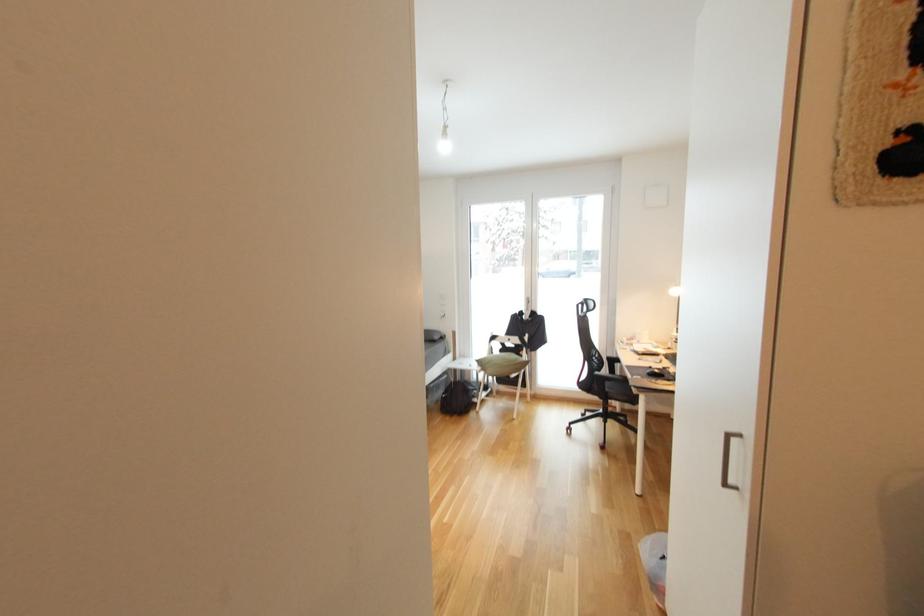
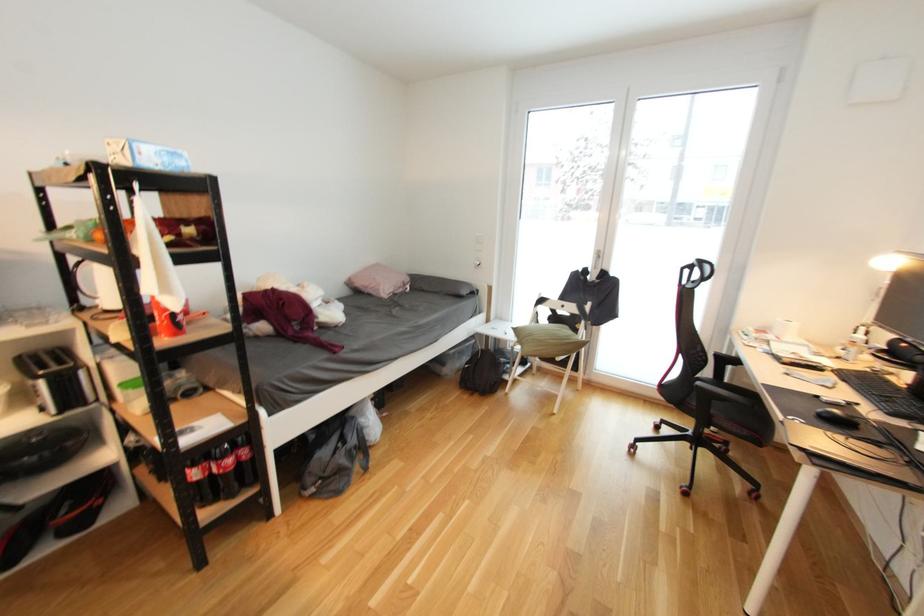
Question: The camera is either moving clockwise (left) or counter-clockwise (right) around the object. The first image is from the beginning of the video and the second image is from the end. Is the camera moving left or right when shooting the video?

Choices:
 (A) Left
 (B) Right

Answer: (B)